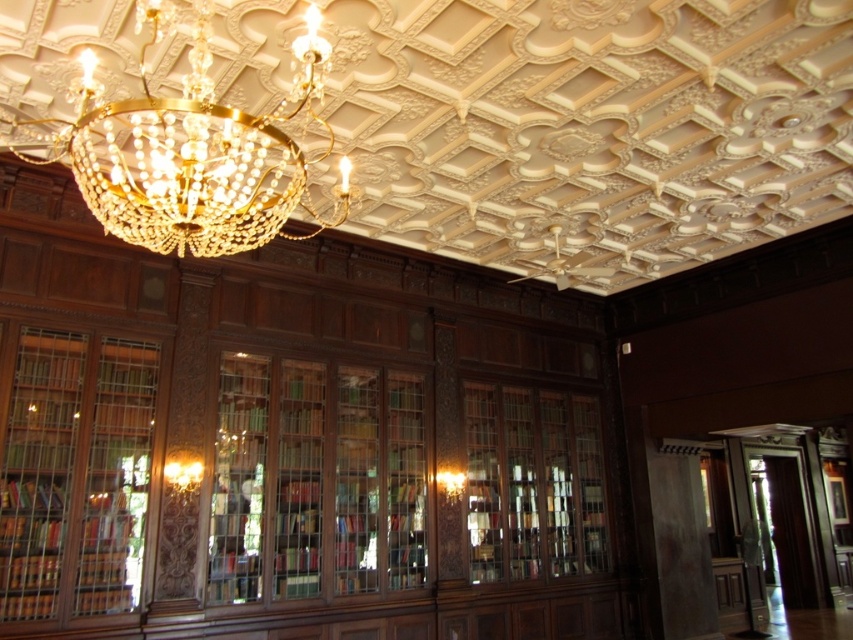
Can you confirm if gold crystal chandelier at upper center is smaller than wooden bookcase at left?

Incorrect, gold crystal chandelier at upper center is not smaller in size than wooden bookcase at left.

Between gold crystal chandelier at upper center and wooden bookcase at left, which one is positioned higher?

Positioned higher is gold crystal chandelier at upper center.

The height and width of the screenshot is (640, 853). Describe the element at coordinates (189, 150) in the screenshot. I see `gold crystal chandelier at upper center` at that location.

I want to click on gold crystal chandelier at upper center, so click(x=189, y=150).